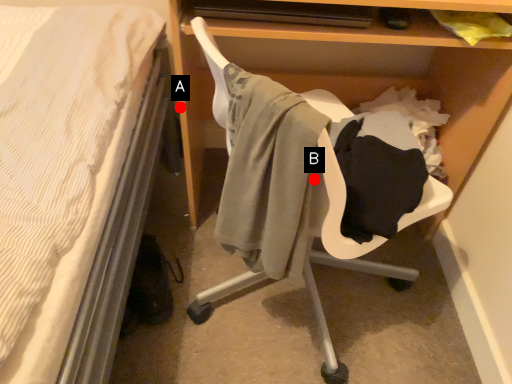
Question: Two points are circled on the image, labeled by A and B beside each circle. Which point appears farthest from the camera in this image?

Choices:
 (A) A is further
 (B) B is further

Answer: (A)